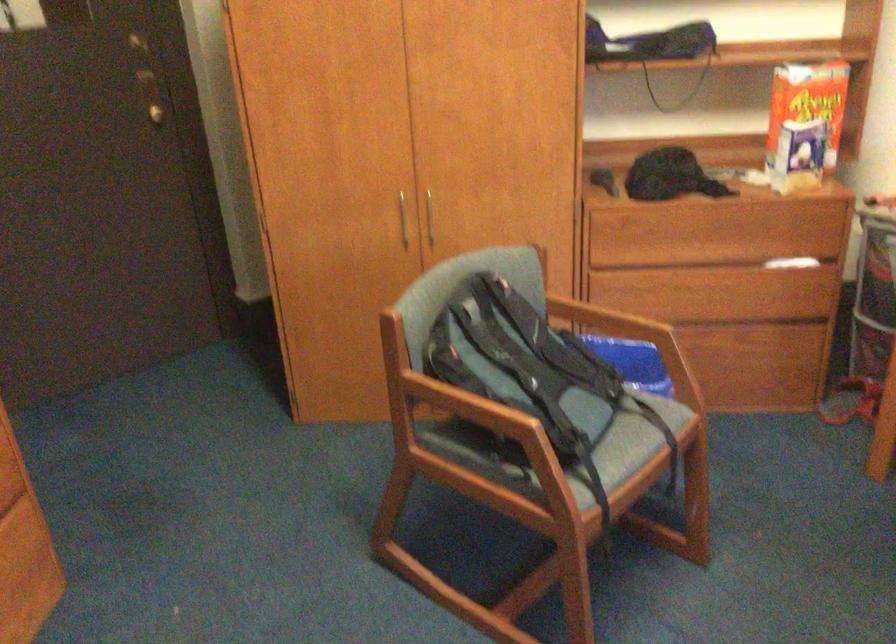
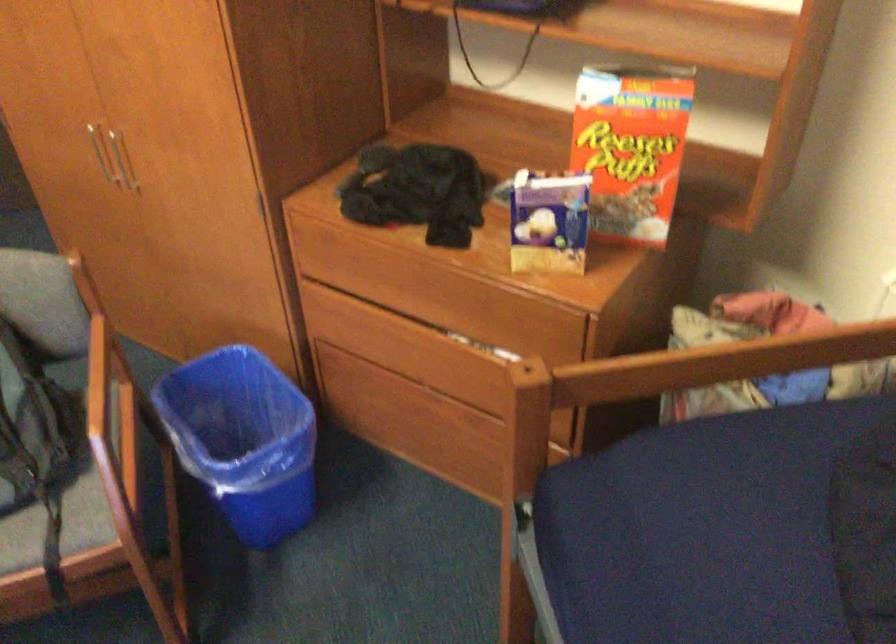
Find the pixel in the second image that matches [659,455] in the first image.

(55, 576)